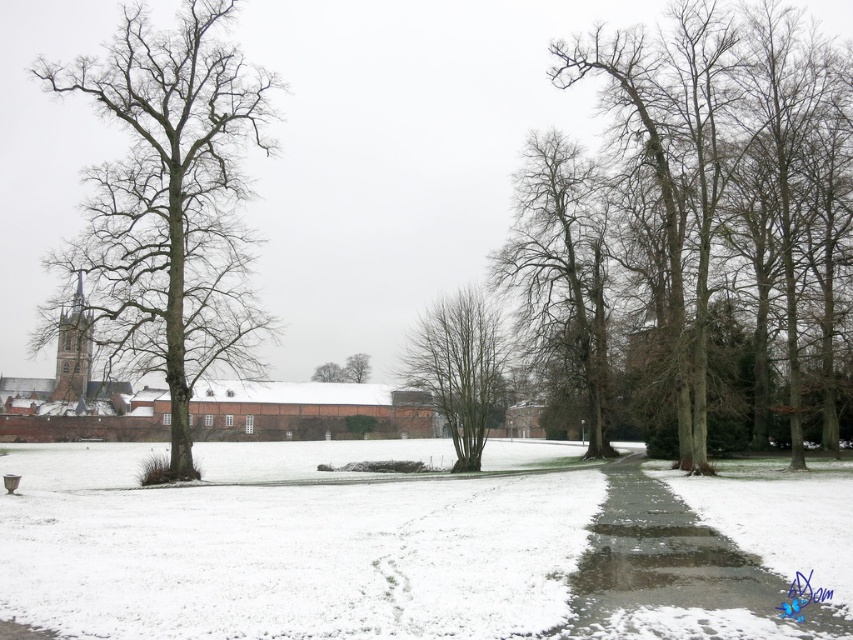
Question: Which point is farther to the camera?

Choices:
 (A) (163, 170)
 (B) (782, 621)

Answer: (A)

Question: Which of the following is the farthest from the observer?

Choices:
 (A) (734, 564)
 (B) (521, 237)
 (C) (440, 410)
 (D) (189, 538)

Answer: (B)

Question: Is white powdery snow at center to the right of bare wood tree at left from the viewer's perspective?

Choices:
 (A) no
 (B) yes

Answer: (B)

Question: Is bare wood tree at left wider than bare branches at center?

Choices:
 (A) yes
 (B) no

Answer: (A)

Question: Can you confirm if bare branches at center is positioned to the right of green textured tree at center?

Choices:
 (A) no
 (B) yes

Answer: (B)

Question: Which point appears closest to the camera in this image?

Choices:
 (A) (840, 624)
 (B) (453, 376)
 (C) (312, 378)
 (D) (126, 540)

Answer: (A)